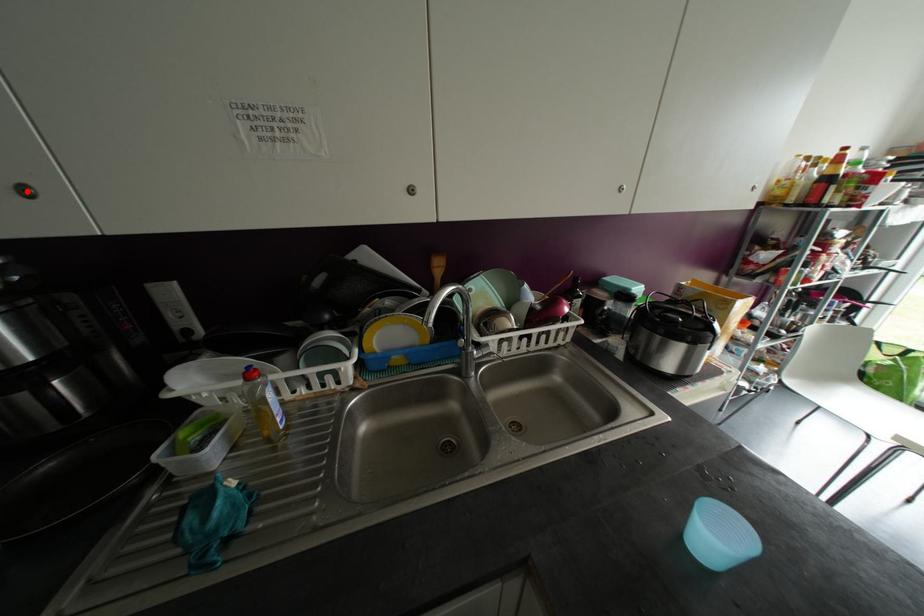
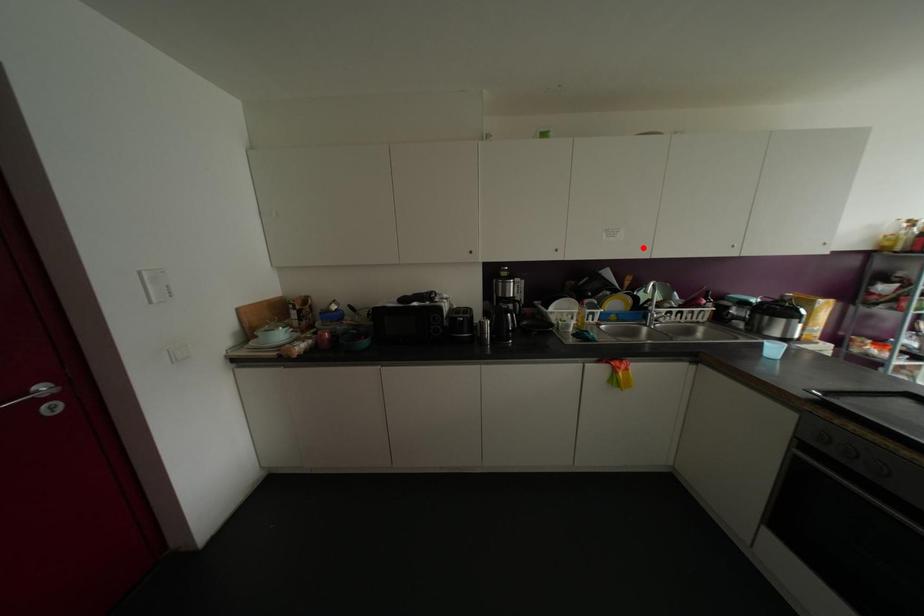
I am providing you with two images of the same scene from different viewpoints. A red point is marked on the first image and another point is marked on the second image. Do the highlighted points in image1 and image2 indicate the same real-world spot?

No